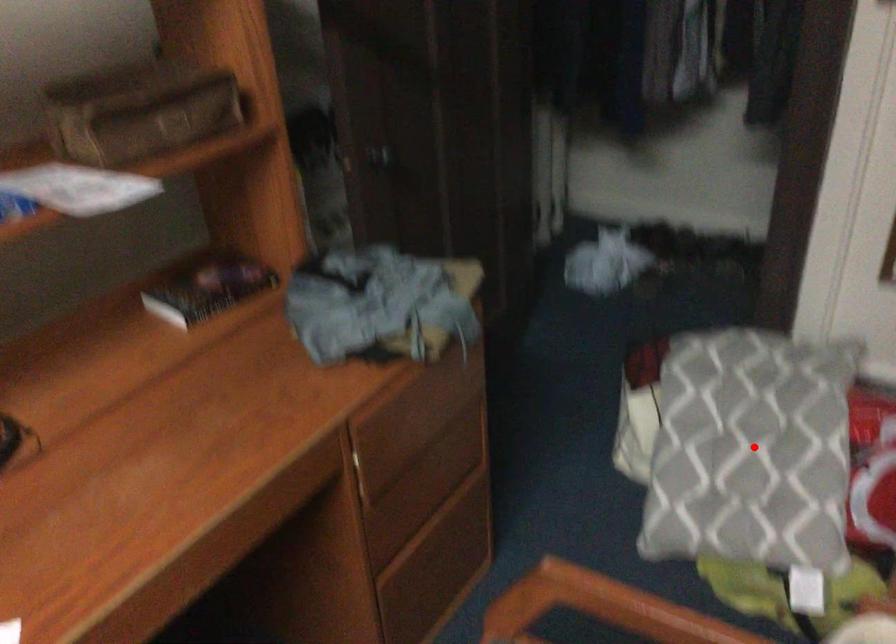
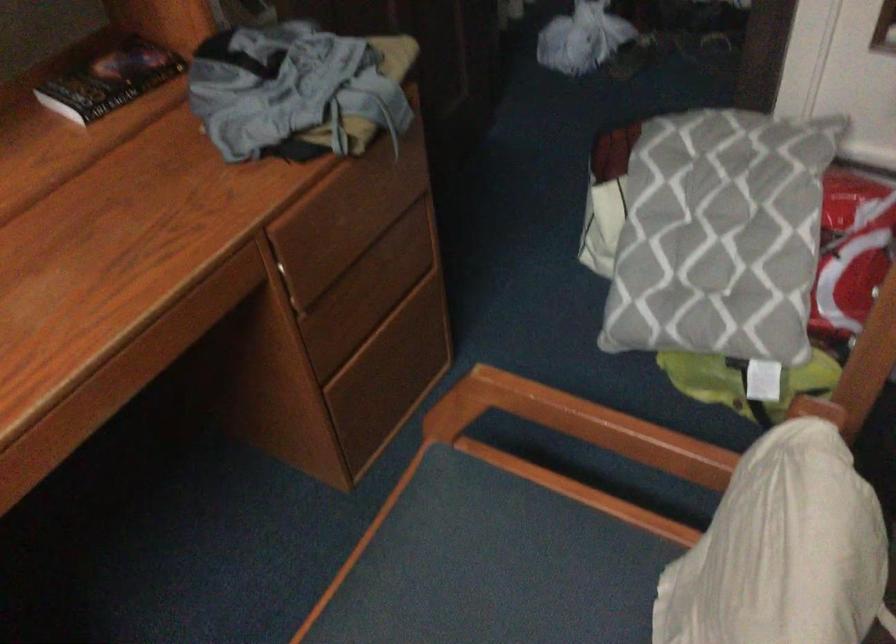
The point at the highlighted location is marked in the first image. Where is the corresponding point in the second image?

(719, 236)